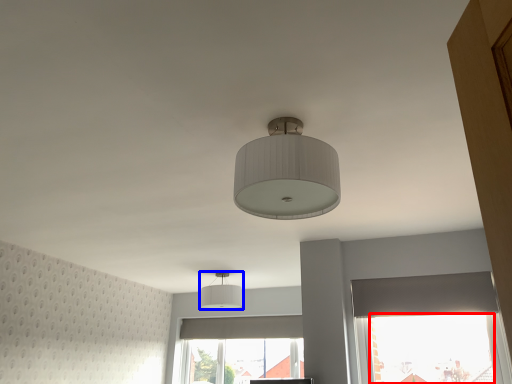
Question: Which object is further to the camera taking this photo, window screen (highlighted by a red box) or lamp (highlighted by a blue box)?

Choices:
 (A) window screen
 (B) lamp

Answer: (B)